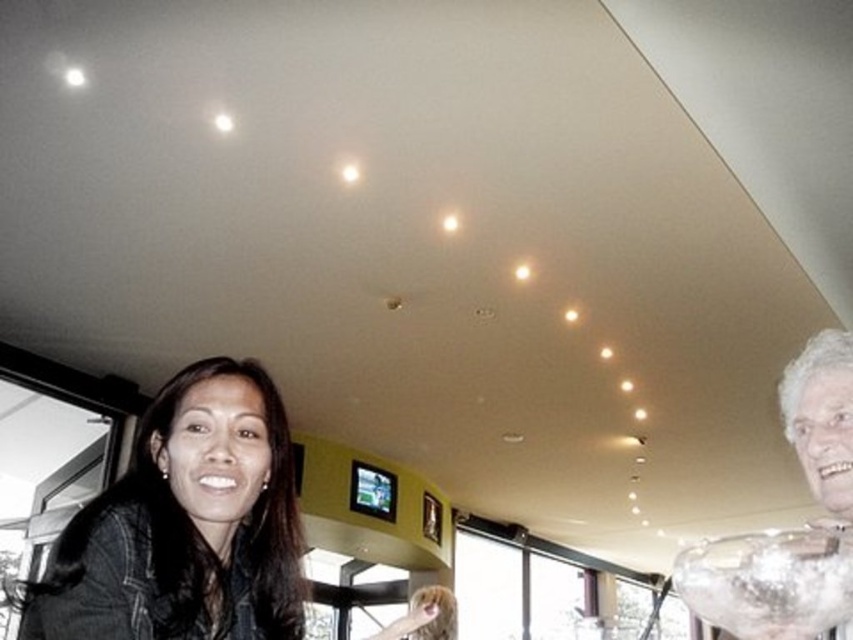
The image size is (853, 640). What do you see at coordinates (793, 529) in the screenshot?
I see `white frosted glass bowl at right` at bounding box center [793, 529].

Who is positioned more to the right, white frosted glass bowl at right or clear glass bowl at upper right?

From the viewer's perspective, white frosted glass bowl at right appears more on the right side.

Is point (764, 608) less distant than point (723, 547)?

Yes, point (764, 608) is in front of point (723, 547).

Image resolution: width=853 pixels, height=640 pixels. I want to click on white frosted glass bowl at right, so click(793, 529).

Who is more forward, (212, 624) or (848, 445)?

Point (848, 445)

The width and height of the screenshot is (853, 640). What do you see at coordinates (186, 524) in the screenshot?
I see `matte black jacket at lower left` at bounding box center [186, 524].

Image resolution: width=853 pixels, height=640 pixels. In order to click on matte black jacket at lower left in this screenshot , I will do coord(186,524).

Who is higher up, matte black jacket at lower left or clear glass bowl at upper right?

matte black jacket at lower left is higher up.

Identify the location of matte black jacket at lower left. This screenshot has width=853, height=640. (186, 524).